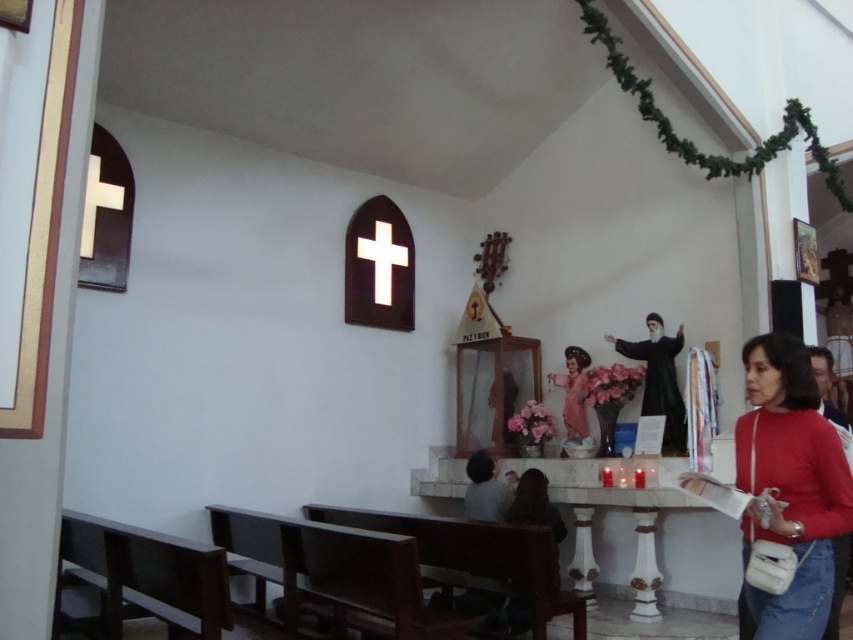
You are standing in the chapel and need to place a matte red sweater at lower right. Where exactly should you place it according to the coordinates provided?

The matte red sweater at lower right should be placed at the coordinates point (788, 484) as specified.

You are standing inside the church and want to pick up the matte red sweater at lower right. Is the brown wooden bench at lower center blocking your path to it?

The matte red sweater at lower right is closer to the viewer than the brown wooden bench at lower center, so the bench is not blocking your path to the sweater.

You are standing at the entrance of the church and want to place a gift basket on the floor between the matte red sweater at lower right and the pink satin doll at center. The gift basket requires 2 meters of space. Do you think there is enough space between them to place the gift basket?

The distance between the matte red sweater at lower right and the pink satin doll at center is 3.50 meters, so yes, there is enough space to place the gift basket requiring 2 meters of space between them.